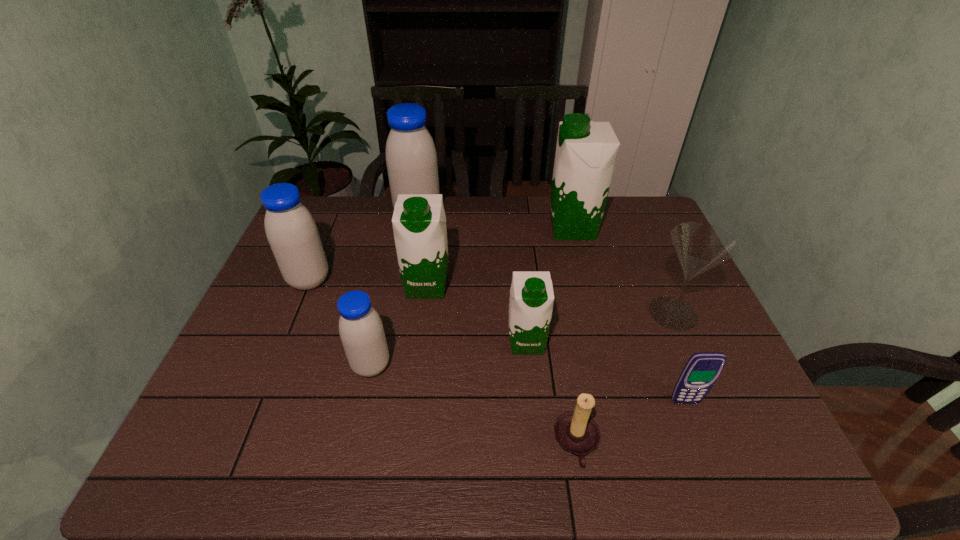
Where is `cellular telephone situated at the right edge`? This screenshot has height=540, width=960. cellular telephone situated at the right edge is located at coordinates (701, 371).

The width and height of the screenshot is (960, 540). Find the location of `vacant space at the far edge`. vacant space at the far edge is located at coordinates (384, 196).

I want to click on blank space at the near edge, so click(594, 453).

Locate an element on the screen. vacant point at the left edge is located at coordinates (298, 347).

You are a GUI agent. You are given a task and a screenshot of the screen. Output one action in this format:
    pyautogui.click(x=<x>, y=<y>)
    Task: Click on the vacant region at the right edge of the desktop
    The width and height of the screenshot is (960, 540).
    Given the screenshot: What is the action you would take?
    point(654,252)

This screenshot has width=960, height=540. Identify the location of free region at the far left corner of the desktop. point(337,195).

At what (x,y) coordinates should I click in order to perform the action: click on vacant region at the far right corner of the desktop. Please return your answer as a coordinate pair (x, y). Looking at the image, I should click on (637, 203).

The image size is (960, 540). Find the location of `free area in between the second green soya milk from left to right and the leftmost green soya milk`. free area in between the second green soya milk from left to right and the leftmost green soya milk is located at coordinates click(477, 314).

Where is `free point between the nearest object and the nearest blue soya milk`? Image resolution: width=960 pixels, height=540 pixels. free point between the nearest object and the nearest blue soya milk is located at coordinates (473, 405).

Identify the location of free space that is in between the second smallest green soya milk and the smallest blue soya milk. Image resolution: width=960 pixels, height=540 pixels. (399, 326).